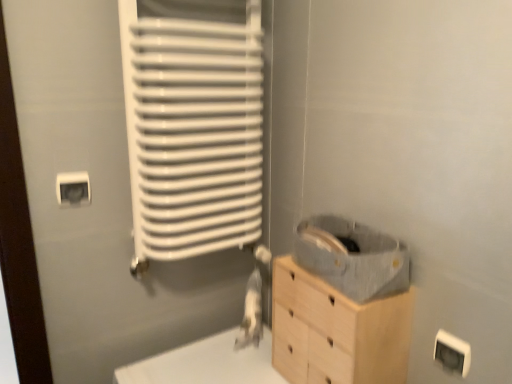
How much space does white plastic electric outlet at upper left, the first electric outlet positioned from the left, occupy vertically?

8.67 centimeters.

What do you see at coordinates (336, 331) in the screenshot? The width and height of the screenshot is (512, 384). I see `light wood chest of drawers at lower right` at bounding box center [336, 331].

This screenshot has width=512, height=384. In order to click on white matte radiator at left in this screenshot , I will do tap(193, 132).

Considering the sizes of objects white plastic electric outlet at lower right, which is the 1th electric outlet in right-to-left order, and white matte radiator at left in the image provided, who is wider, white plastic electric outlet at lower right, which is the 1th electric outlet in right-to-left order, or white matte radiator at left?

Wider between the two is white matte radiator at left.

From a real-world perspective, which is physically below, white plastic electric outlet at lower right, the second electric outlet in the left-to-right sequence, or white matte radiator at left?

From a 3D spatial view, white plastic electric outlet at lower right, the second electric outlet in the left-to-right sequence, is below.

Is white plastic electric outlet at lower right, which appears as the 2th electric outlet when viewed from the top, aimed at white matte radiator at left?

No, white plastic electric outlet at lower right, which appears as the 2th electric outlet when viewed from the top, is not aimed at white matte radiator at left.

The height and width of the screenshot is (384, 512). I want to click on electric outlet that is behind the white plastic electric outlet at lower right, positioned as the first electric outlet in front-to-back order, so click(73, 189).

From a real-world perspective, relative to white plastic electric outlet at lower right, which appears as the 2th electric outlet when viewed from the top, is white plastic electric outlet at upper left, the first electric outlet positioned from the left, vertically above or below?

white plastic electric outlet at upper left, the first electric outlet positioned from the left, is above white plastic electric outlet at lower right, which appears as the 2th electric outlet when viewed from the top.

Is white plastic electric outlet at upper left, which appears as the second electric outlet when viewed from the right, with white plastic electric outlet at lower right, which appears as the 2th electric outlet when viewed from the top?

No, white plastic electric outlet at upper left, which appears as the second electric outlet when viewed from the right, is not with white plastic electric outlet at lower right, which appears as the 2th electric outlet when viewed from the top.

Is white plastic electric outlet at lower right, the 2th electric outlet when ordered from back to front, in front of or behind white plastic electric outlet at upper left, the 2th electric outlet from the front, in the image?

white plastic electric outlet at lower right, the 2th electric outlet when ordered from back to front, is positioned closer to the viewer than white plastic electric outlet at upper left, the 2th electric outlet from the front.

Considering the points (439, 352) and (80, 173), which point is behind, point (439, 352) or point (80, 173)?

Point (80, 173)

Is white plastic electric outlet at lower right, which ranks as the first electric outlet in bottom-to-top order, inside the boundaries of white plastic electric outlet at upper left, which ranks as the second electric outlet in bottom-to-top order, or outside?

white plastic electric outlet at lower right, which ranks as the first electric outlet in bottom-to-top order, is outside white plastic electric outlet at upper left, which ranks as the second electric outlet in bottom-to-top order.

Is light wood chest of drawers at lower right far away from white plastic electric outlet at upper left, which ranks as the second electric outlet in bottom-to-top order?

light wood chest of drawers at lower right is near white plastic electric outlet at upper left, which ranks as the second electric outlet in bottom-to-top order, not far away.

Consider the image. How much distance is there between light wood chest of drawers at lower right and white plastic electric outlet at upper left, which is the 1th electric outlet from top to bottom?

light wood chest of drawers at lower right and white plastic electric outlet at upper left, which is the 1th electric outlet from top to bottom, are 27.78 inches apart from each other.

How many degrees apart are the facing directions of light wood chest of drawers at lower right and white plastic electric outlet at upper left, acting as the first electric outlet starting from the back?

The angle between the facing direction of light wood chest of drawers at lower right and the facing direction of white plastic electric outlet at upper left, acting as the first electric outlet starting from the back, is 90 degrees.

Can you confirm if light wood chest of drawers at lower right is shorter than white plastic electric outlet at upper left, the 2th electric outlet from the front?

Incorrect, the height of light wood chest of drawers at lower right does not fall short of that of white plastic electric outlet at upper left, the 2th electric outlet from the front.

Does white plastic electric outlet at upper left, which ranks as the second electric outlet in bottom-to-top order, have a lesser width compared to light wood chest of drawers at lower right?

Yes.

From the image's perspective, which is below, white plastic electric outlet at upper left, which appears as the second electric outlet when viewed from the right, or light wood chest of drawers at lower right?

light wood chest of drawers at lower right.

Considering the relative sizes of white plastic electric outlet at upper left, which appears as the second electric outlet when viewed from the right, and light wood chest of drawers at lower right in the image provided, is white plastic electric outlet at upper left, which appears as the second electric outlet when viewed from the right, shorter than light wood chest of drawers at lower right?

Indeed, white plastic electric outlet at upper left, which appears as the second electric outlet when viewed from the right, has a lesser height compared to light wood chest of drawers at lower right.

You are a GUI agent. You are given a task and a screenshot of the screen. Output one action in this format:
    pyautogui.click(x=<x>, y=<y>)
    Task: Click on the electric outlet that appears behind the light wood chest of drawers at lower right
    The image size is (512, 384).
    Given the screenshot: What is the action you would take?
    click(x=73, y=189)

Can you tell me how much white plastic electric outlet at upper left, acting as the first electric outlet starting from the back, and white matte radiator at left differ in facing direction?

The angle between the facing direction of white plastic electric outlet at upper left, acting as the first electric outlet starting from the back, and the facing direction of white matte radiator at left is 0.877 degrees.

Does white plastic electric outlet at upper left, acting as the first electric outlet starting from the back, have a greater width compared to white matte radiator at left?

In fact, white plastic electric outlet at upper left, acting as the first electric outlet starting from the back, might be narrower than white matte radiator at left.

Is white plastic electric outlet at upper left, the first electric outlet positioned from the left, positioned with its back to white matte radiator at left?

No.

Between white plastic electric outlet at upper left, the 2th electric outlet from the front, and white matte radiator at left, which one is positioned in front?

white matte radiator at left is in front.

Which of these two, white matte radiator at left or white plastic electric outlet at lower right, the 2th electric outlet when ordered from back to front, is thinner?

With smaller width is white plastic electric outlet at lower right, the 2th electric outlet when ordered from back to front.

From the image's perspective, would you say white matte radiator at left is positioned over white plastic electric outlet at lower right, which is the 1th electric outlet in right-to-left order?

Yes, from the image's perspective, white matte radiator at left is on top of white plastic electric outlet at lower right, which is the 1th electric outlet in right-to-left order.

Is white matte radiator at left at the right side of white plastic electric outlet at lower right, the second electric outlet in the left-to-right sequence?

No.

Identify the location of radiator above the white plastic electric outlet at lower right, positioned as the first electric outlet in front-to-back order (from a real-world perspective). This screenshot has width=512, height=384. (193, 132).

You are a GUI agent. You are given a task and a screenshot of the screen. Output one action in this format:
    pyautogui.click(x=<x>, y=<y>)
    Task: Click on the electric outlet located in front of the white plastic electric outlet at upper left, which is the 1th electric outlet from top to bottom
    The height and width of the screenshot is (384, 512).
    Given the screenshot: What is the action you would take?
    pyautogui.click(x=452, y=353)

Estimate the real-world distances between objects in this image. Which object is closer to white matte radiator at left, white plastic electric outlet at upper left, acting as the first electric outlet starting from the back, or white plastic electric outlet at lower right, the second electric outlet in the left-to-right sequence?

white plastic electric outlet at upper left, acting as the first electric outlet starting from the back, is positioned closer to the anchor white matte radiator at left.

When comparing their distances from white plastic electric outlet at upper left, the first electric outlet positioned from the left, does light wood chest of drawers at lower right or white matte radiator at left seem further?

Among the two, light wood chest of drawers at lower right is located further to white plastic electric outlet at upper left, the first electric outlet positioned from the left.

Estimate the real-world distances between objects in this image. Which object is closer to white plastic electric outlet at upper left, acting as the first electric outlet starting from the back, white plastic electric outlet at lower right, the 2th electric outlet when ordered from back to front, or light wood chest of drawers at lower right?

light wood chest of drawers at lower right is closer to white plastic electric outlet at upper left, acting as the first electric outlet starting from the back.

Considering their positions, is white plastic electric outlet at upper left, which ranks as the second electric outlet in bottom-to-top order, positioned further to light wood chest of drawers at lower right than white plastic electric outlet at lower right, positioned as the first electric outlet in front-to-back order?

white plastic electric outlet at upper left, which ranks as the second electric outlet in bottom-to-top order, lies further to light wood chest of drawers at lower right than the other object.

Based on their spatial positions, is white plastic electric outlet at lower right, the second electric outlet in the left-to-right sequence, or light wood chest of drawers at lower right further from white matte radiator at left?

white plastic electric outlet at lower right, the second electric outlet in the left-to-right sequence, is positioned further to the anchor white matte radiator at left.

In the scene shown: Based on their spatial positions, is white plastic electric outlet at upper left, the first electric outlet positioned from the left, or white matte radiator at left further from white plastic electric outlet at lower right, positioned as the first electric outlet in front-to-back order?

white plastic electric outlet at upper left, the first electric outlet positioned from the left, is further to white plastic electric outlet at lower right, positioned as the first electric outlet in front-to-back order.

Based on their spatial positions, is white matte radiator at left or light wood chest of drawers at lower right further from white plastic electric outlet at upper left, the first electric outlet positioned from the left?

light wood chest of drawers at lower right is further to white plastic electric outlet at upper left, the first electric outlet positioned from the left.

Which object lies nearer to the anchor point white plastic electric outlet at lower right, the second electric outlet in the left-to-right sequence, light wood chest of drawers at lower right or white matte radiator at left?

light wood chest of drawers at lower right.

Image resolution: width=512 pixels, height=384 pixels. What are the coordinates of `radiator between white plastic electric outlet at upper left, which appears as the second electric outlet when viewed from the right, and light wood chest of drawers at lower right, in the horizontal direction` in the screenshot? It's located at (193, 132).

You are a GUI agent. You are given a task and a screenshot of the screen. Output one action in this format:
    pyautogui.click(x=<x>, y=<y>)
    Task: Click on the radiator between white plastic electric outlet at upper left, acting as the first electric outlet starting from the back, and white plastic electric outlet at lower right, which is the 1th electric outlet in right-to-left order, in the horizontal direction
    
    Given the screenshot: What is the action you would take?
    pyautogui.click(x=193, y=132)

Find the location of a particular element. Image resolution: width=512 pixels, height=384 pixels. the chest of drawers situated between white matte radiator at left and white plastic electric outlet at lower right, which ranks as the first electric outlet in bottom-to-top order, from left to right is located at coordinates (336, 331).

At what (x,y) coordinates should I click in order to perform the action: click on chest of drawers between white plastic electric outlet at upper left, the 2th electric outlet from the front, and white plastic electric outlet at lower right, the 2th electric outlet when ordered from back to front, from left to right. Please return your answer as a coordinate pair (x, y). Looking at the image, I should click on (336, 331).